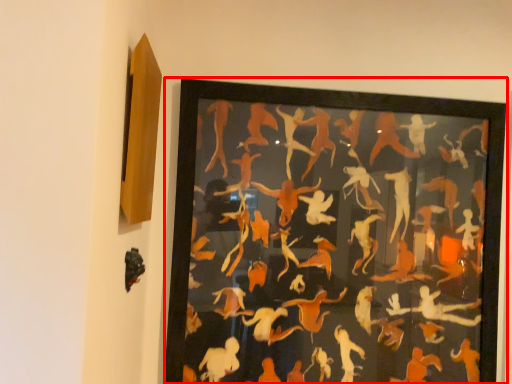
Question: From the image, what is the correct spatial relationship of picture frame (annotated by the red box) in relation to animal?

Choices:
 (A) left
 (B) right

Answer: (B)